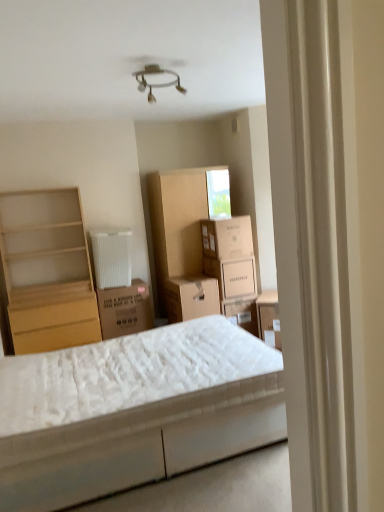
Question: Does light wood shelf at left have a larger size compared to white quilted mattress at center?

Choices:
 (A) no
 (B) yes

Answer: (A)

Question: Considering the relative sizes of light wood shelf at left and white quilted mattress at center in the image provided, is light wood shelf at left thinner than white quilted mattress at center?

Choices:
 (A) yes
 (B) no

Answer: (A)

Question: Is light wood shelf at left at the left side of white quilted mattress at center?

Choices:
 (A) no
 (B) yes

Answer: (B)

Question: Could you tell me if light wood shelf at left is facing white quilted mattress at center?

Choices:
 (A) yes
 (B) no

Answer: (A)

Question: Is light wood shelf at left to the right of white quilted mattress at center from the viewer's perspective?

Choices:
 (A) yes
 (B) no

Answer: (B)

Question: In terms of width, does light wood shelf at left look wider or thinner when compared to white quilted mattress at center?

Choices:
 (A) thin
 (B) wide

Answer: (A)

Question: Based on their sizes in the image, would you say light wood shelf at left is bigger or smaller than white quilted mattress at center?

Choices:
 (A) big
 (B) small

Answer: (B)

Question: Is point (34, 206) positioned closer to the camera than point (11, 406)?

Choices:
 (A) farther
 (B) closer

Answer: (A)

Question: Considering the positions of light wood shelf at left and white quilted mattress at center in the image, is light wood shelf at left taller or shorter than white quilted mattress at center?

Choices:
 (A) tall
 (B) short

Answer: (A)

Question: Looking at the image, does light wood shelf at left seem bigger or smaller compared to brown cardboard box at center, marked as the first cardboard box in a left-to-right arrangement?

Choices:
 (A) big
 (B) small

Answer: (A)

Question: Based on their positions, is light wood shelf at left located to the left or right of brown cardboard box at center, which is counted as the 3th cardboard box, starting from the right?

Choices:
 (A) left
 (B) right

Answer: (A)

Question: From the image's perspective, is light wood shelf at left positioned above or below brown cardboard box at center, marked as the first cardboard box in a left-to-right arrangement?

Choices:
 (A) below
 (B) above

Answer: (B)

Question: Would you say light wood shelf at left is inside or outside brown cardboard box at center, which is counted as the 3th cardboard box, starting from the right?

Choices:
 (A) inside
 (B) outside

Answer: (B)

Question: Is white cardboard box at center, positioned as the 1th cardboard box in right-to-left order, in front of or behind white quilted mattress at center in the image?

Choices:
 (A) front
 (B) behind

Answer: (B)

Question: Would you say white cardboard box at center, positioned as the 1th cardboard box in right-to-left order, is to the left or to the right of white quilted mattress at center in the picture?

Choices:
 (A) left
 (B) right

Answer: (B)